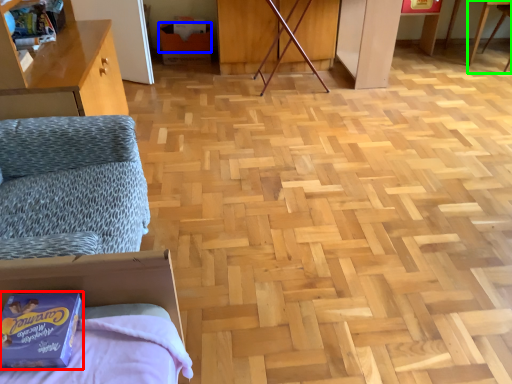
Question: Estimate the real-world distances between objects in this image. Which object is farther from package (highlighted by a red box), cardboard box (highlighted by a blue box) or table (highlighted by a green box)?

Choices:
 (A) cardboard box
 (B) table

Answer: (B)